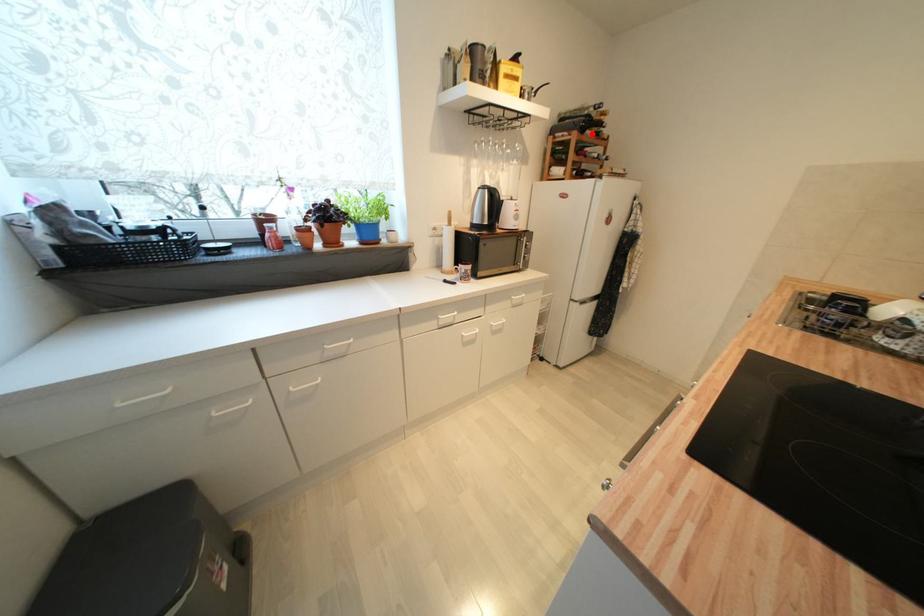
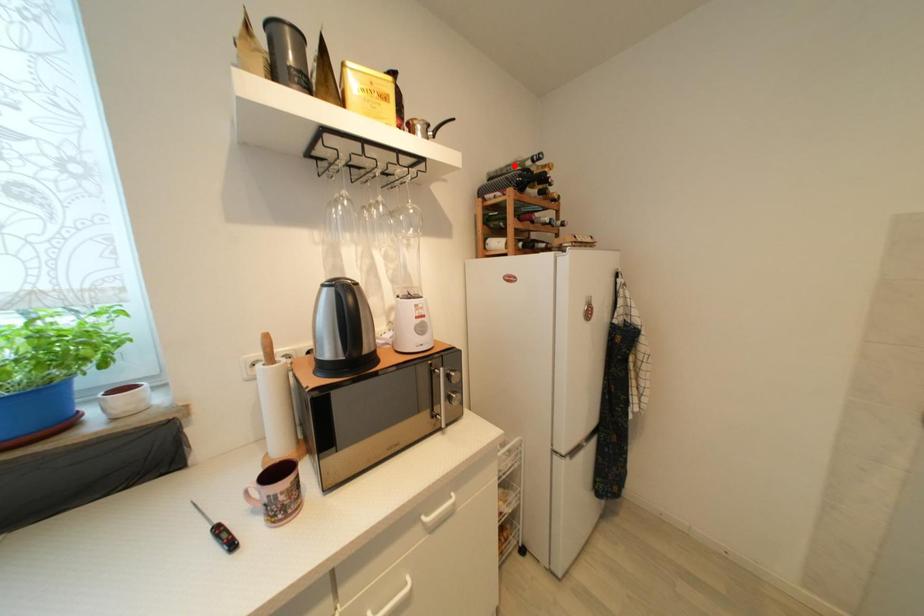
I am providing you with two images of the same scene from different viewpoints. A red point is marked on the first image and another point is marked on the second image. Is the red point in image1 aligned with the point shown in image2?

No